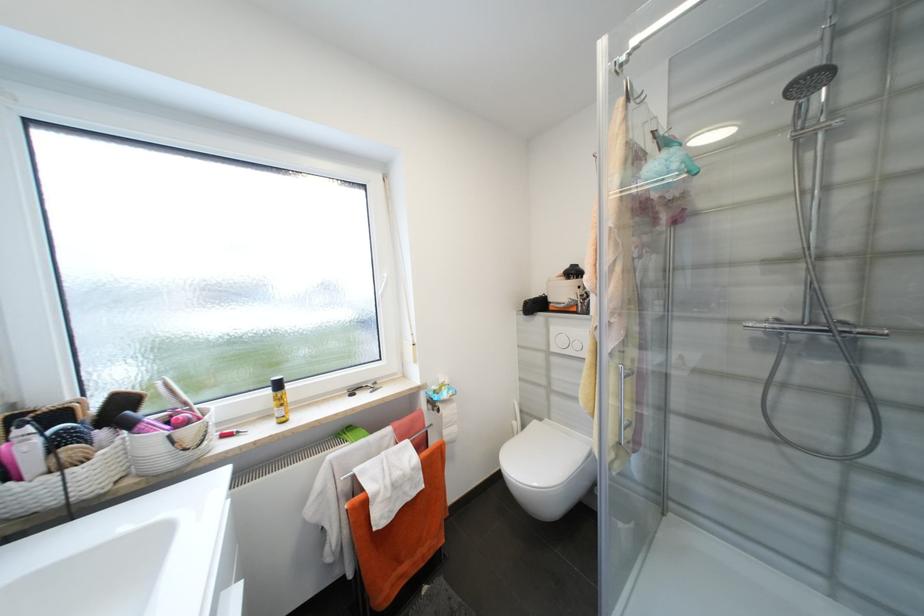
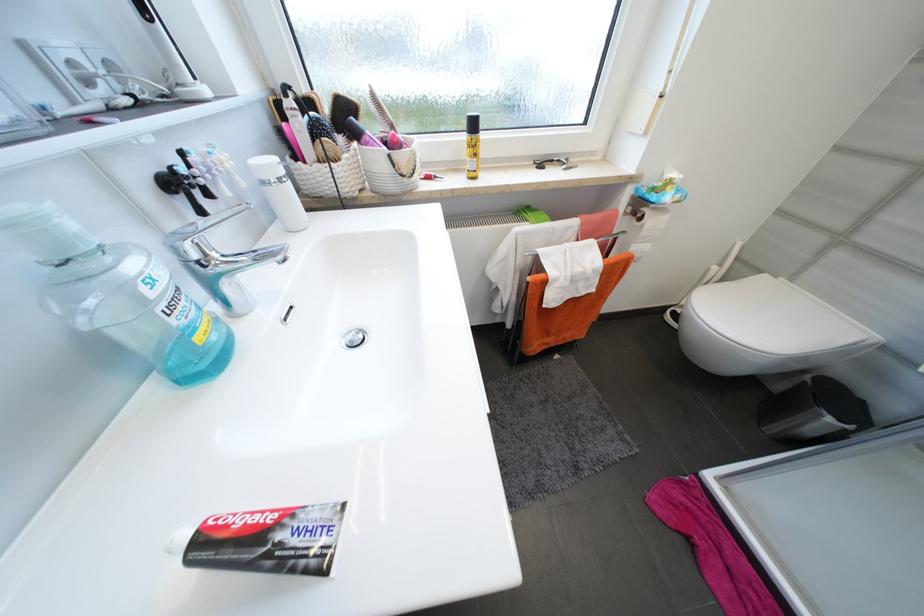
How did the camera likely rotate?

The camera rotated toward left-down.